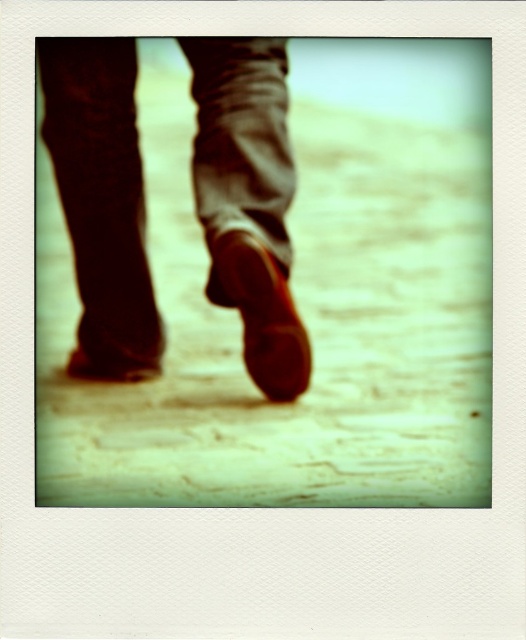
Question: Can you confirm if yellow stone pavement at center is positioned to the left of shiny brown shoe at center?

Choices:
 (A) no
 (B) yes

Answer: (A)

Question: Which object is farther from the camera taking this photo?

Choices:
 (A) shiny brown shoe at center
 (B) matte brown shoe at center

Answer: (A)

Question: Estimate the real-world distances between objects in this image. Which object is farther from the matte brown shoe at center?

Choices:
 (A) shiny brown shoe at center
 (B) yellow stone pavement at center

Answer: (B)

Question: Is yellow stone pavement at center below matte brown shoe at center?

Choices:
 (A) no
 (B) yes

Answer: (A)

Question: Is yellow stone pavement at center positioned in front of shiny brown shoe at center?

Choices:
 (A) no
 (B) yes

Answer: (B)

Question: Based on their relative distances, which object is farther from the matte brown shoe at center?

Choices:
 (A) yellow stone pavement at center
 (B) shiny brown shoe at center

Answer: (A)